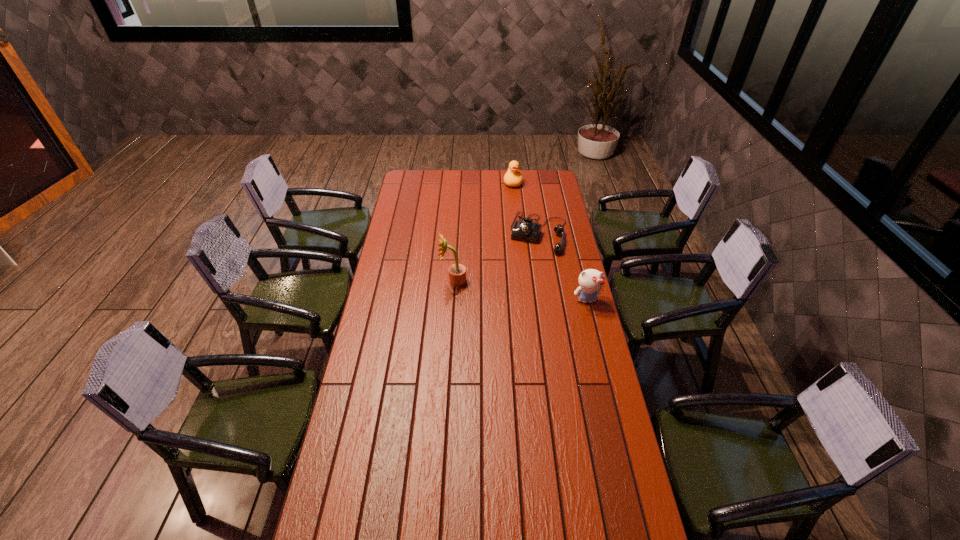
Where is `vacant area that lies between the shortest object and the second shortest object`? vacant area that lies between the shortest object and the second shortest object is located at coordinates (526, 207).

Find the location of a particular element. The height and width of the screenshot is (540, 960). free space between the second tallest object and the third farthest object is located at coordinates (520, 291).

Find the location of a particular element. unoccupied position between the leftmost object and the second farthest object is located at coordinates (496, 257).

Find the location of a particular element. The height and width of the screenshot is (540, 960). free space between the kitten and the second farthest object is located at coordinates (563, 266).

What are the coordinates of `the second closest object relative to the kitten` in the screenshot? It's located at (457, 272).

Find the location of `the third closest object to the farthest object`. the third closest object to the farthest object is located at coordinates (591, 281).

You are a GUI agent. You are given a task and a screenshot of the screen. Output one action in this format:
    pyautogui.click(x=<x>, y=<y>)
    Task: Click on the vacant area that satisfies the following two spatial constraints: 1. on the front side of the farthest object; 2. on the right side of the shortest object
    
    Given the screenshot: What is the action you would take?
    pyautogui.click(x=518, y=233)